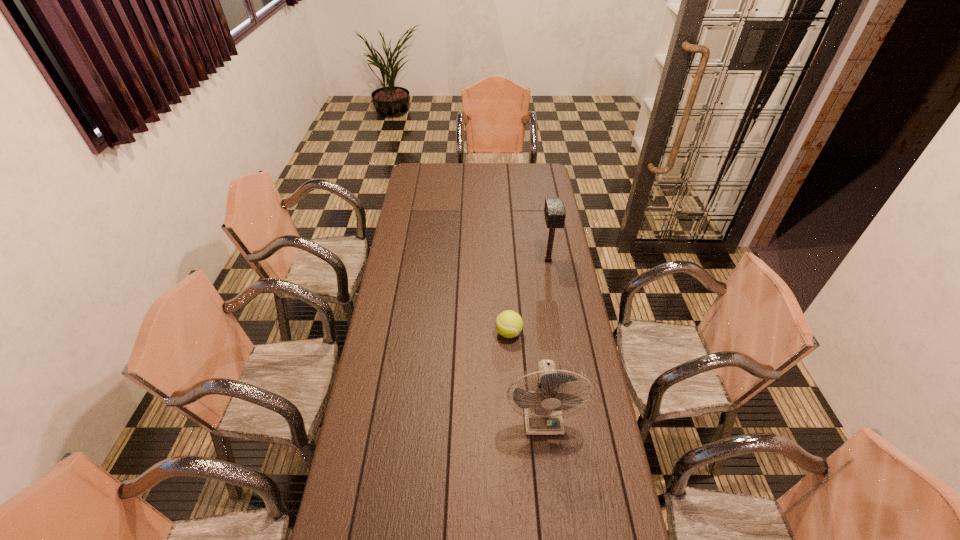
I want to click on blank space at the left edge of the desktop, so click(x=370, y=527).

Locate an element on the screen. Image resolution: width=960 pixels, height=540 pixels. free space at the right edge of the desktop is located at coordinates (568, 422).

Locate an element on the screen. vacant point located between the shortest object and the mallet is located at coordinates (528, 296).

Where is `free area in between the second farthest object and the mallet`? The image size is (960, 540). free area in between the second farthest object and the mallet is located at coordinates (528, 296).

The width and height of the screenshot is (960, 540). In order to click on free space between the farthest object and the nearest object in this screenshot , I will do `click(545, 338)`.

Find the location of `free area in between the shortest object and the nearest object`. free area in between the shortest object and the nearest object is located at coordinates (525, 374).

Where is `free space that is in between the second farthest object and the farthest object`? free space that is in between the second farthest object and the farthest object is located at coordinates (528, 296).

At what (x,y) coordinates should I click in order to perform the action: click on vacant space in between the fan and the shortest object. Please return your answer as a coordinate pair (x, y). This screenshot has width=960, height=540. Looking at the image, I should click on (525, 374).

This screenshot has width=960, height=540. What are the coordinates of `object identified as the second closest to the second farthest object` in the screenshot? It's located at (554, 211).

Identify which object is the closest to the mallet. Please provide its 2D coordinates. Your answer should be formatted as a tuple, i.e. [(x, y)], where the tuple contains the x and y coordinates of a point satisfying the conditions above.

[(509, 324)]